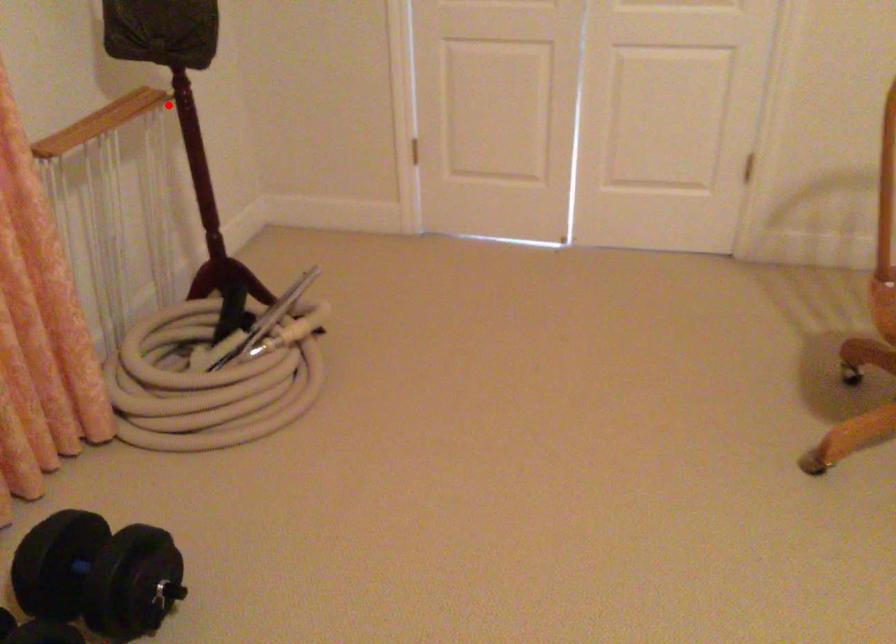
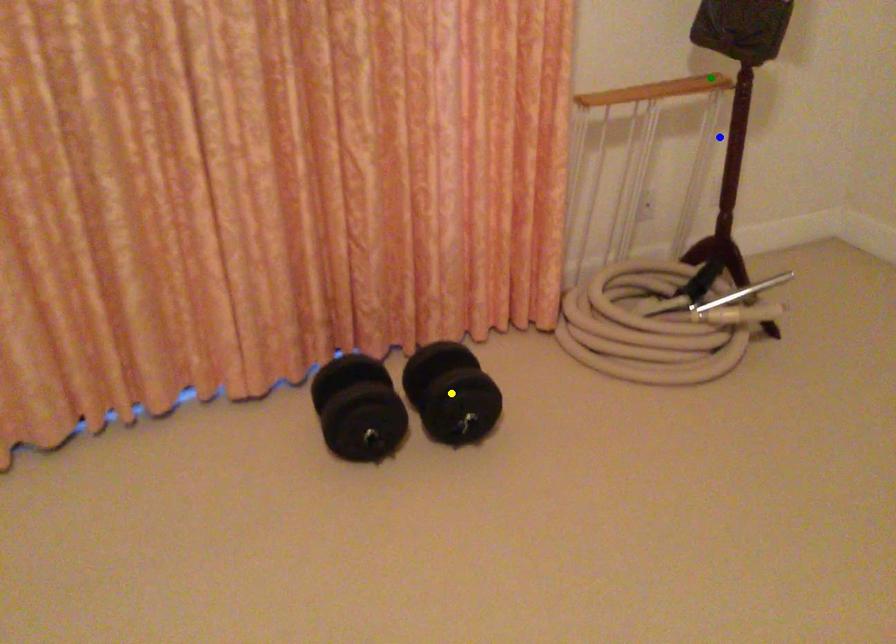
Question: I am providing you with two images of the same scene from different viewpoints. A red point is marked on the first image. You are given multiple points on the second image. In image 2, which mark is for the same physical point as the one in image 1?

Choices:
 (A) green point
 (B) yellow point
 (C) blue point

Answer: (A)